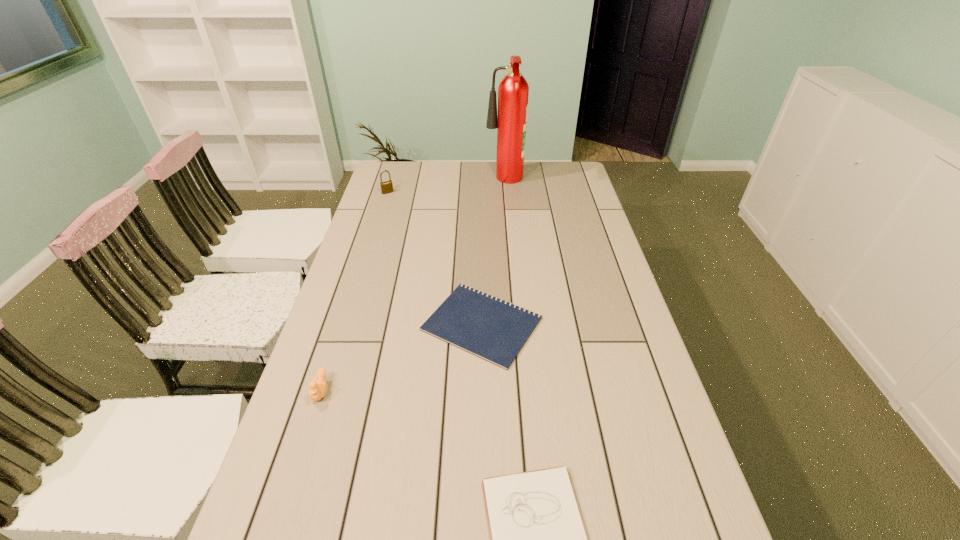
I want to click on free spot located on the face of the fourth farthest object, so click(x=310, y=424).

You are a GUI agent. You are given a task and a screenshot of the screen. Output one action in this format:
    pyautogui.click(x=<x>, y=<y>)
    Task: Click on the blank space located on the left of the shortest object
    This screenshot has height=540, width=960.
    Given the screenshot: What is the action you would take?
    pyautogui.click(x=396, y=324)

At what (x,y) coordinates should I click in order to perform the action: click on object situated at the far edge. Please return your answer as a coordinate pair (x, y). The image size is (960, 540). Looking at the image, I should click on (513, 90).

Where is `padlock positioned at the left edge`? padlock positioned at the left edge is located at coordinates (386, 187).

The image size is (960, 540). In order to click on duckling situated at the left edge in this screenshot , I will do `click(317, 389)`.

In order to click on free spot at the far edge of the desktop in this screenshot , I will do pos(448,164).

Locate an element on the screen. free location at the left edge of the desktop is located at coordinates (345, 449).

Locate an element on the screen. The width and height of the screenshot is (960, 540). vacant space at the right edge is located at coordinates (572, 270).

Identify the location of free space at the far left corner. (416, 168).

This screenshot has height=540, width=960. Find the location of `vacant space that's between the fourth farthest object and the shorter notepad`. vacant space that's between the fourth farthest object and the shorter notepad is located at coordinates (401, 357).